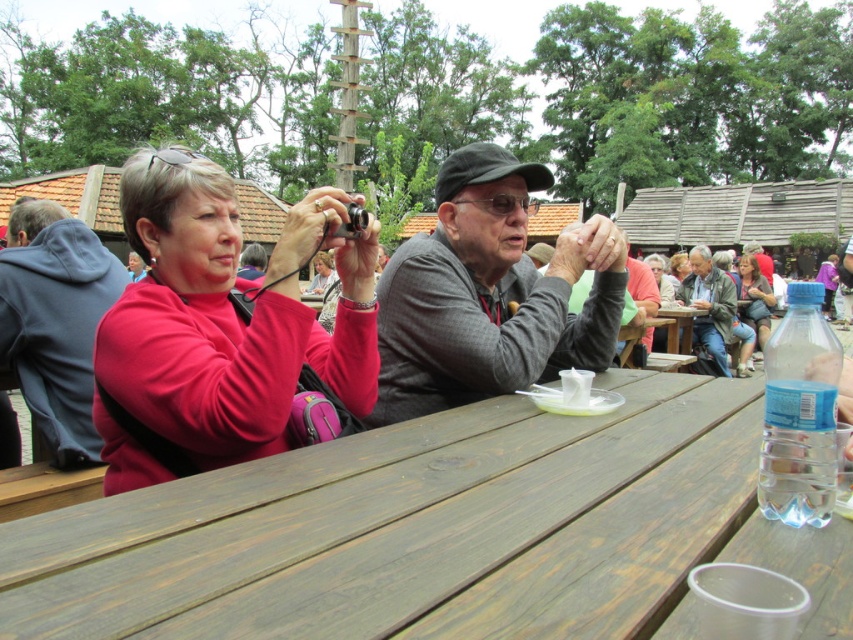
Does leather jacket at center have a smaller size compared to denim jacket at upper right?

Correct, leather jacket at center occupies less space than denim jacket at upper right.

Does point (695, 340) lie in front of point (751, 268)?

Yes, it is in front of point (751, 268).

This screenshot has width=853, height=640. What are the coordinates of `leather jacket at center` in the screenshot? It's located at (709, 305).

From the picture: Is gray woolen sweater at center wider than purple fabric dress at center?

No.

Can you confirm if gray woolen sweater at center is thinner than purple fabric dress at center?

Yes, gray woolen sweater at center is thinner than purple fabric dress at center.

Which is behind, point (556, 244) or point (821, 276)?

Point (821, 276)

Where is `gray woolen sweater at center`? The image size is (853, 640). gray woolen sweater at center is located at coordinates (489, 292).

How much distance is there between matte pink hoodie at left and leather jacket at center?

They are 5.89 meters apart.

Can you confirm if matte pink hoodie at left is positioned below leather jacket at center?

Yes.

Is point (28, 317) closer to viewer compared to point (712, 328)?

Yes.

The height and width of the screenshot is (640, 853). I want to click on matte pink hoodie at left, so click(x=55, y=321).